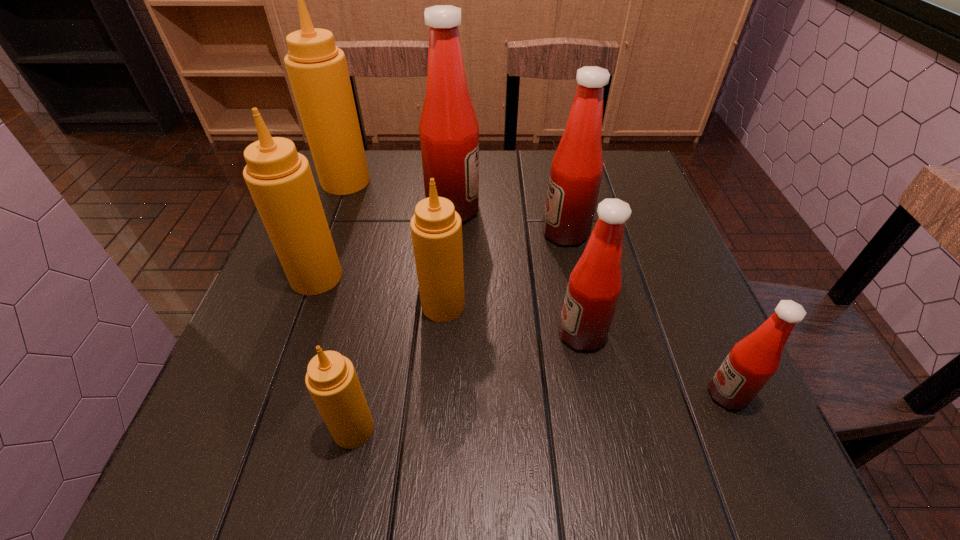
This screenshot has width=960, height=540. Find the location of `vacant space at the right edge of the desktop`. vacant space at the right edge of the desktop is located at coordinates (679, 261).

Identify the location of free space at the far left corner of the desktop. Image resolution: width=960 pixels, height=540 pixels. (342, 199).

Where is `free space at the near left corner of the desktop`? free space at the near left corner of the desktop is located at coordinates (217, 482).

In order to click on free spot at the far right corner of the desktop in this screenshot , I will do `click(626, 166)`.

Locate an element on the screen. vacant space in between the second tan condiment from right to left and the third biggest tan condiment is located at coordinates (398, 367).

What are the coordinates of `vacant space in between the biggest red condiment and the third condiment from left to right` in the screenshot? It's located at (403, 320).

At what (x,y) coordinates should I click in order to perform the action: click on free space between the rightmost condiment and the smallest tan condiment. Please return your answer as a coordinate pair (x, y). Image resolution: width=960 pixels, height=540 pixels. Looking at the image, I should click on (540, 411).

I want to click on vacant region between the leftmost red condiment and the second nearest red condiment, so click(x=517, y=272).

Identify the location of blank region between the second tan condiment from right to left and the second biggest red condiment. (460, 331).

This screenshot has height=540, width=960. I want to click on vacant area between the rightmost tan condiment and the third farthest red condiment, so click(x=513, y=320).